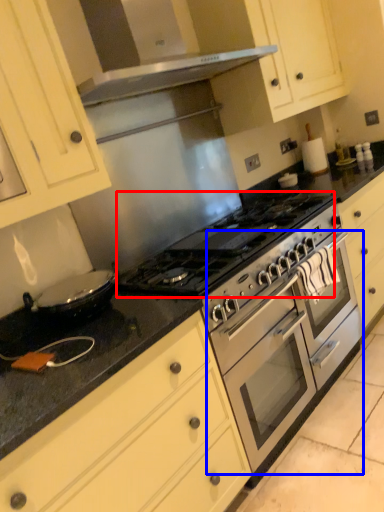
Question: Which object appears farthest to the camera in this image, gas stove (highlighted by a red box) or oven (highlighted by a blue box)?

Choices:
 (A) gas stove
 (B) oven

Answer: (B)